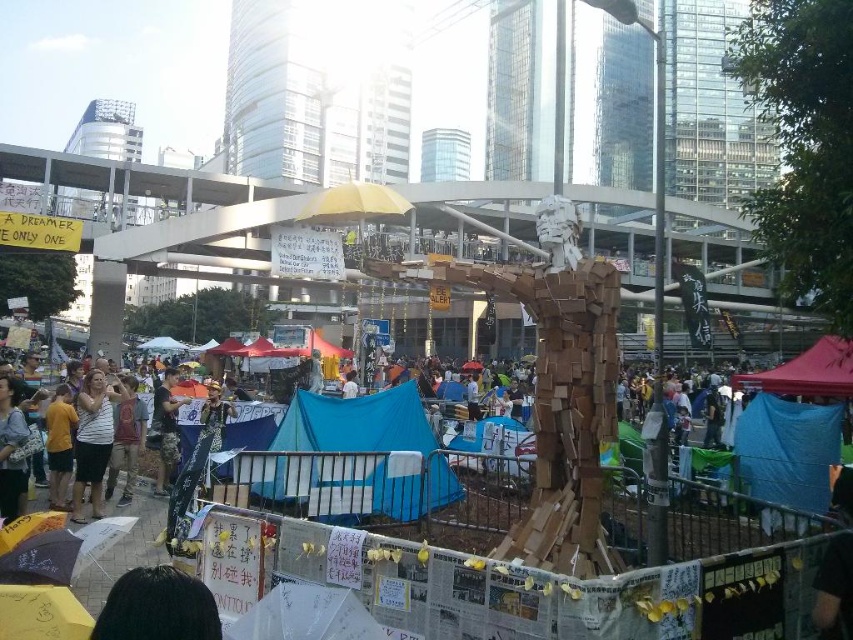
You are a photographer capturing the protest scene. You notice a white striped shirt at center and a yellow fabric at lower left. Which object is located more to the right in the image?

The white striped shirt at center is positioned on the right side of the yellow fabric at lower left, so it is more to the right.

You are a delivery person who needs to place a 3.5 feet wide package between the yellow fabric at lower left and the camouflage pants at center. Can you fit it there?

The yellow fabric at lower left is 8.27 feet from the camouflage pants at center. Since the package is 3.5 feet wide, it can fit in the space between them as there is enough distance.